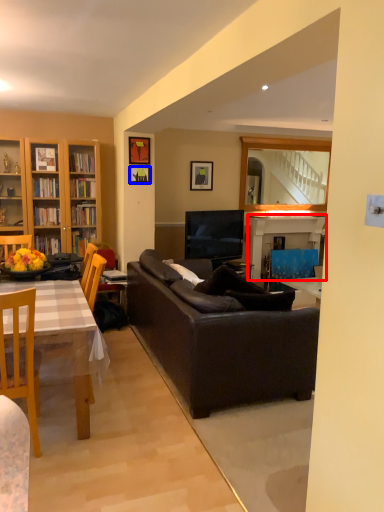
Question: Which point is further to the camera, fireplace (highlighted by a red box) or picture frame (highlighted by a blue box)?

Choices:
 (A) fireplace
 (B) picture frame

Answer: (A)